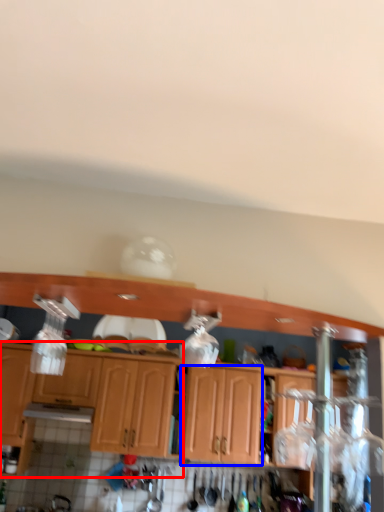
Question: Which of the following is the farthest to the observer, cabinetry (highlighted by a red box) or cabinetry (highlighted by a blue box)?

Choices:
 (A) cabinetry
 (B) cabinetry

Answer: (B)